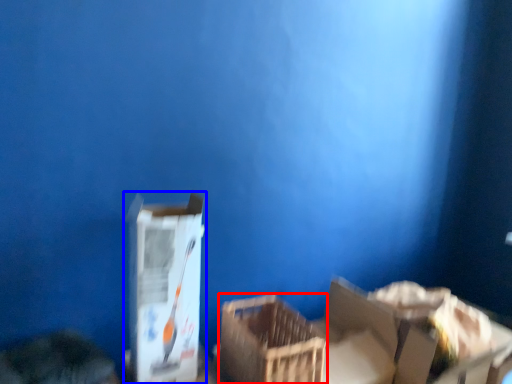
Question: Among these objects, which one is farthest to the camera, crate (highlighted by a red box) or box (highlighted by a blue box)?

Choices:
 (A) crate
 (B) box

Answer: (A)